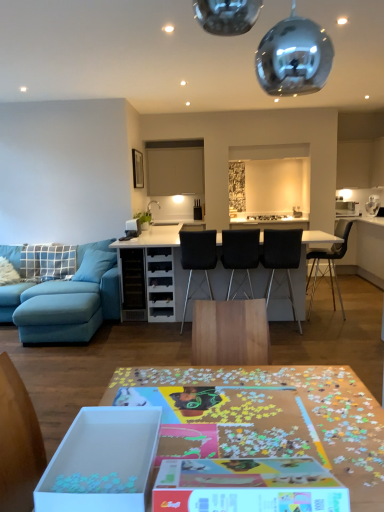
The height and width of the screenshot is (512, 384). What do you see at coordinates (95, 265) in the screenshot?
I see `blue fabric pillow at left, which ranks as the first pillow in right-to-left order` at bounding box center [95, 265].

Image resolution: width=384 pixels, height=512 pixels. I want to click on black textured chair at center, the third chair from the left, so click(x=282, y=259).

What do you see at coordinates (102, 462) in the screenshot?
I see `white cardboard box at lower left` at bounding box center [102, 462].

Where is `blue fabric pillow at left, marked as the second pillow in a right-to-left arrangement`? blue fabric pillow at left, marked as the second pillow in a right-to-left arrangement is located at coordinates click(x=47, y=261).

The width and height of the screenshot is (384, 512). Identify the location of velvet blue couch at left. pos(66,300).

Identify the location of the 2nd table positioned below the black textured chair at center, which is the second chair from right to left (from a real-world perspective). (267, 417).

Is black textured chair at center, the third chair from the left, to the left of wooden puzzle pieces at center, the 1th table when ordered from front to back, from the viewer's perspective?

Incorrect, black textured chair at center, the third chair from the left, is not on the left side of wooden puzzle pieces at center, the 1th table when ordered from front to back.

Which is nearer, (x=298, y=248) or (x=376, y=494)?

Point (x=298, y=248) is farther from the camera than point (x=376, y=494).

Between black textured chair at center, the third chair from the left, and wooden puzzle pieces at center, the 1th table when ordered from front to back, which one has smaller width?

Thinner between the two is black textured chair at center, the third chair from the left.

Who is smaller, black matte chair at center, placed as the third chair when sorted from right to left, or black textured chair at center, which is the second chair from right to left?

Smaller between the two is black matte chair at center, placed as the third chair when sorted from right to left.

Is black matte chair at center, placed as the third chair when sorted from right to left, far away from black textured chair at center, the third chair from the left?

Actually, black matte chair at center, placed as the third chair when sorted from right to left, and black textured chair at center, the third chair from the left, are a little close together.

Is black matte chair at center, placed as the third chair when sorted from right to left, closer to camera compared to black textured chair at center, which is the second chair from right to left?

No, black matte chair at center, placed as the third chair when sorted from right to left, is behind black textured chair at center, which is the second chair from right to left.

Can you confirm if black matte chair at center, placed as the third chair when sorted from right to left, is wider than black textured chair at center, the third chair from the left?

Correct, the width of black matte chair at center, placed as the third chair when sorted from right to left, exceeds that of black textured chair at center, the third chair from the left.

How many degrees apart are the facing directions of blue fabric pillow at left, which is the 2th pillow from left to right, and black fabric chair at center, the 4th chair viewed from the right?

They differ by 155 degrees in their facing directions.

Considering the relative sizes of blue fabric pillow at left, which ranks as the first pillow in right-to-left order, and black fabric chair at center, the 4th chair viewed from the right, in the image provided, is blue fabric pillow at left, which ranks as the first pillow in right-to-left order, shorter than black fabric chair at center, the 4th chair viewed from the right,?

Yes.

Is blue fabric pillow at left, which is the 2th pillow from left to right, smaller than black fabric chair at center, positioned as the first chair in left-to-right order?

Correct, blue fabric pillow at left, which is the 2th pillow from left to right, occupies less space than black fabric chair at center, positioned as the first chair in left-to-right order.

In the scene shown: Would you say blue fabric pillow at left, which is the 2th pillow from left to right, is inside or outside black fabric chair at center, positioned as the first chair in left-to-right order?

blue fabric pillow at left, which is the 2th pillow from left to right, is spatially situated outside black fabric chair at center, positioned as the first chair in left-to-right order.

From a real-world perspective, is white glossy table at center, arranged as the 2th table when viewed from the front, positioned under black textured chair at center, which is the second chair from right to left, based on gravity?

Yes, from a real-world perspective, white glossy table at center, arranged as the 2th table when viewed from the front, is below black textured chair at center, which is the second chair from right to left.

Can you tell me how much white glossy table at center, arranged as the 2th table when viewed from the front, and black textured chair at center, which is the second chair from right to left, differ in facing direction?

2.44 degrees.

Is white glossy table at center, arranged as the 2th table when viewed from the front, looking in the opposite direction of black textured chair at center, which is the second chair from right to left?

That's right, white glossy table at center, arranged as the 2th table when viewed from the front, is facing away from black textured chair at center, which is the second chair from right to left.

Can you confirm if velvet blue couch at left is positioned to the left of black fabric chair at center, the 4th chair viewed from the right?

Correct, you'll find velvet blue couch at left to the left of black fabric chair at center, the 4th chair viewed from the right.

Is point (92, 258) positioned before point (189, 257)?

No, it is behind (189, 257).

Is velvet blue couch at left oriented towards black fabric chair at center, the 4th chair viewed from the right?

No, velvet blue couch at left does not turn towards black fabric chair at center, the 4th chair viewed from the right.

From the picture: Between velvet blue couch at left and black fabric chair at center, positioned as the first chair in left-to-right order, which one has more height?

black fabric chair at center, positioned as the first chair in left-to-right order.

Would you say black fabric chair at center, positioned as the first chair in left-to-right order, is part of black leather chair at center, placed as the 1th chair when sorted from right to left,'s contents?

No, black fabric chair at center, positioned as the first chair in left-to-right order, is located outside of black leather chair at center, placed as the 1th chair when sorted from right to left.

Is the position of black leather chair at center, which appears as the fourth chair when viewed from the left, less distant than that of black fabric chair at center, positioned as the first chair in left-to-right order?

No.

From a real-world perspective, is black leather chair at center, placed as the 1th chair when sorted from right to left, positioned over black fabric chair at center, the 4th chair viewed from the right, based on gravity?

No, from a real-world perspective, black leather chair at center, placed as the 1th chair when sorted from right to left, is not above black fabric chair at center, the 4th chair viewed from the right.

Is black leather chair at center, which appears as the fourth chair when viewed from the left, far away from black fabric chair at center, positioned as the first chair in left-to-right order?

That's right, there is a large distance between black leather chair at center, which appears as the fourth chair when viewed from the left, and black fabric chair at center, positioned as the first chair in left-to-right order.

Which is closer to the camera, (179, 234) or (277, 255)?

Point (179, 234) is farther from the camera than point (277, 255).

Is black fabric chair at center, positioned as the first chair in left-to-right order, spatially inside black textured chair at center, which is the second chair from right to left, or outside of it?

black fabric chair at center, positioned as the first chair in left-to-right order, is not inside black textured chair at center, which is the second chair from right to left, it's outside.

Is the surface of black fabric chair at center, the 4th chair viewed from the right, in direct contact with black textured chair at center, the third chair from the left?

No, black fabric chair at center, the 4th chair viewed from the right, is not next to black textured chair at center, the third chair from the left.

In order to click on chair that is the 3rd one above the wooden puzzle pieces at center, which is the second table in back-to-front order (from a real-world perspective) in this screenshot , I will do `click(282, 259)`.

Find the location of a particular element. Image resolution: width=384 pixels, height=512 pixels. the 1st chair to the left of the black textured chair at center, the third chair from the left, starting your count from the anchor is located at coordinates (x=240, y=252).

Estimate the real-world distances between objects in this image. Which object is closer to wooden puzzle pieces at center, the 1th table when ordered from front to back, blue fabric pillow at left, which is the 2th pillow from left to right, or velvet blue couch at left?

velvet blue couch at left lies closer to wooden puzzle pieces at center, the 1th table when ordered from front to back, than the other object.

Based on the photo, from the image, which object appears to be nearer to black leather chair at center, placed as the 1th chair when sorted from right to left, black textured chair at center, which is the second chair from right to left, or black matte chair at center, placed as the 2th chair when sorted from left to right?

Among the two, black textured chair at center, which is the second chair from right to left, is located nearer to black leather chair at center, placed as the 1th chair when sorted from right to left.

Estimate the real-world distances between objects in this image. Which object is closer to blue fabric pillow at left, marked as the second pillow in a right-to-left arrangement, white glossy table at center, which is the 1th table in back-to-front order, or black leather chair at center, which appears as the fourth chair when viewed from the left?

white glossy table at center, which is the 1th table in back-to-front order, lies closer to blue fabric pillow at left, marked as the second pillow in a right-to-left arrangement, than the other object.

When comparing their distances from black fabric chair at center, the 4th chair viewed from the right, does black matte chair at center, placed as the 2th chair when sorted from left to right, or white cardboard box at lower left seem further?

white cardboard box at lower left lies further to black fabric chair at center, the 4th chair viewed from the right, than the other object.

From the picture: Which object lies nearer to the anchor point black textured chair at center, the third chair from the left, black fabric chair at center, the 4th chair viewed from the right, or wooden puzzle pieces at center, the 1th table when ordered from front to back?

black fabric chair at center, the 4th chair viewed from the right, lies closer to black textured chair at center, the third chair from the left, than the other object.

Estimate the real-world distances between objects in this image. Which object is further from black matte chair at center, placed as the third chair when sorted from right to left, black textured chair at center, which is the second chair from right to left, or black leather chair at center, placed as the 1th chair when sorted from right to left?

Among the two, black leather chair at center, placed as the 1th chair when sorted from right to left, is located further to black matte chair at center, placed as the third chair when sorted from right to left.

When comparing their distances from black matte chair at center, placed as the 2th chair when sorted from left to right, does blue fabric pillow at left, marked as the second pillow in a right-to-left arrangement, or wooden puzzle pieces at center, which is the second table in back-to-front order, seem further?

Among the two, wooden puzzle pieces at center, which is the second table in back-to-front order, is located further to black matte chair at center, placed as the 2th chair when sorted from left to right.

Which object lies further to the anchor point black textured chair at center, which is the second chair from right to left, black leather chair at center, which appears as the fourth chair when viewed from the left, or black matte chair at center, placed as the third chair when sorted from right to left?

black leather chair at center, which appears as the fourth chair when viewed from the left, is further to black textured chair at center, which is the second chair from right to left.

The height and width of the screenshot is (512, 384). Identify the location of chair between black fabric chair at center, positioned as the first chair in left-to-right order, and black textured chair at center, the third chair from the left, in the horizontal direction. (240, 252).

Identify the location of chair between wooden puzzle pieces at center, the 1th table when ordered from front to back, and black matte chair at center, placed as the third chair when sorted from right to left, along the z-axis. (282, 259).

At what (x,y) coordinates should I click in order to perform the action: click on pillow located between blue fabric pillow at left, which is the first pillow in left-to-right order, and black matte chair at center, placed as the third chair when sorted from right to left, in the left-right direction. Please return your answer as a coordinate pair (x, y). The height and width of the screenshot is (512, 384). Looking at the image, I should click on (95, 265).

Identify the location of table between white cardboard box at lower left and black leather chair at center, which appears as the fourth chair when viewed from the left, from front to back. The width and height of the screenshot is (384, 512). (173, 263).